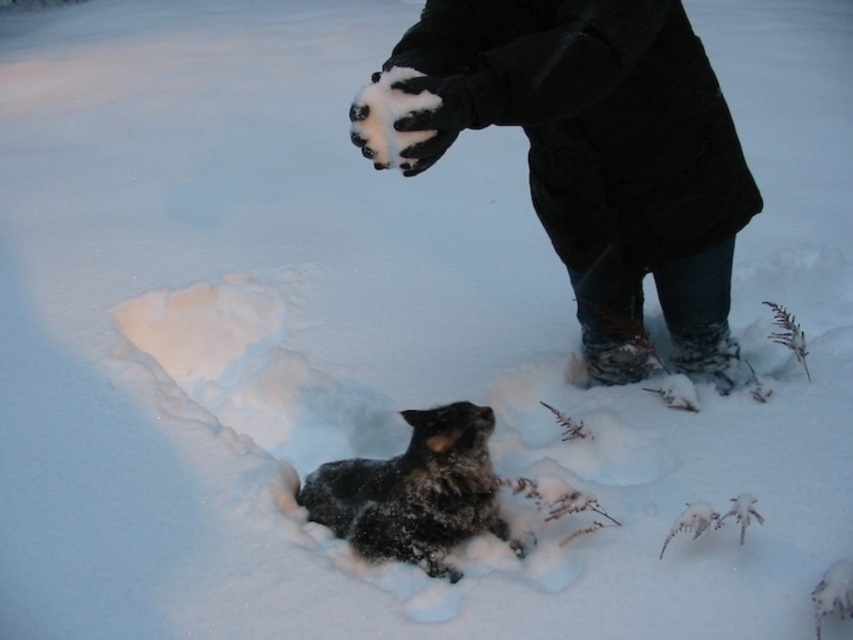
Can you confirm if black woolen coat at upper center is bigger than fuzzy black dog at lower center?

Indeed, black woolen coat at upper center has a larger size compared to fuzzy black dog at lower center.

Can you confirm if black woolen coat at upper center is positioned to the left of fuzzy black dog at lower center?

In fact, black woolen coat at upper center is to the right of fuzzy black dog at lower center.

The width and height of the screenshot is (853, 640). What do you see at coordinates (589, 154) in the screenshot? I see `black woolen coat at upper center` at bounding box center [589, 154].

Locate an element on the screen. The image size is (853, 640). black woolen coat at upper center is located at coordinates (589, 154).